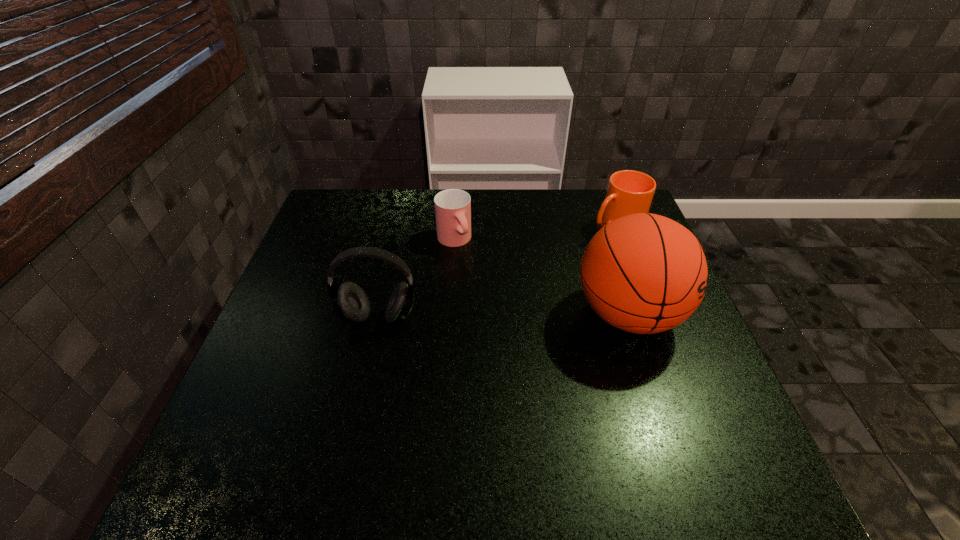
Where is `vacant area that lies between the leftmost object and the second shortest object`? Image resolution: width=960 pixels, height=540 pixels. vacant area that lies between the leftmost object and the second shortest object is located at coordinates (497, 272).

Where is `object that is the closest one to the tallest object`? This screenshot has width=960, height=540. object that is the closest one to the tallest object is located at coordinates (629, 192).

The width and height of the screenshot is (960, 540). Identify the location of the third closest object to the headset. (629, 192).

Identify the location of blank space that satisfies the following two spatial constraints: 1. on the front side of the basketball; 2. on the side with logo of the cup. The image size is (960, 540). (448, 314).